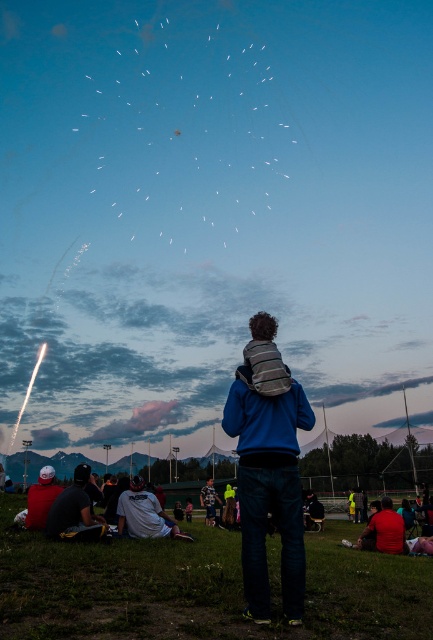
Can you confirm if blue fleece jacket at center is positioned to the left of dark blue shirt at lower left?

No, blue fleece jacket at center is not to the left of dark blue shirt at lower left.

Is blue fleece jacket at center thinner than dark blue shirt at lower left?

Indeed, blue fleece jacket at center has a lesser width compared to dark blue shirt at lower left.

Which is behind, point (252, 589) or point (68, 524)?

The point (68, 524) is more distant.

Find the location of a particular element. The image size is (433, 640). blue fleece jacket at center is located at coordinates (270, 490).

Is dark blue shirt at lower left to the right of red fabric shirt at lower right from the viewer's perspective?

In fact, dark blue shirt at lower left is to the left of red fabric shirt at lower right.

Which is behind, point (65, 515) or point (398, 531)?

The point (398, 531) is behind.

Locate an element on the screen. This screenshot has height=640, width=433. dark blue shirt at lower left is located at coordinates (74, 512).

Who is more forward, (193, 132) or (223, 561)?

Point (223, 561) is more forward.

Does white stringy kite at upper center have a greater height compared to green grass at lower center?

Correct, white stringy kite at upper center is much taller as green grass at lower center.

Between point (96, 88) and point (268, 544), which one is positioned in front?

Point (268, 544) is in front.

I want to click on white stringy kite at upper center, so click(x=191, y=129).